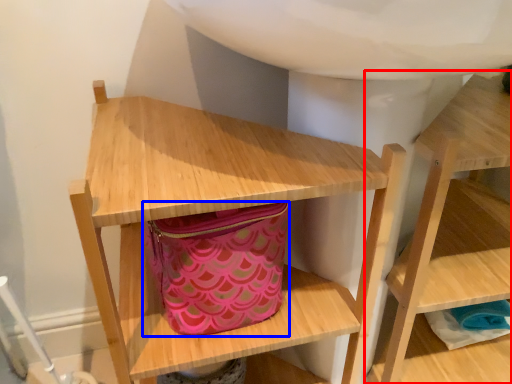
Question: Which of the following is the farthest to the observer, shelf (highlighted by a red box) or bag (highlighted by a blue box)?

Choices:
 (A) shelf
 (B) bag

Answer: (B)